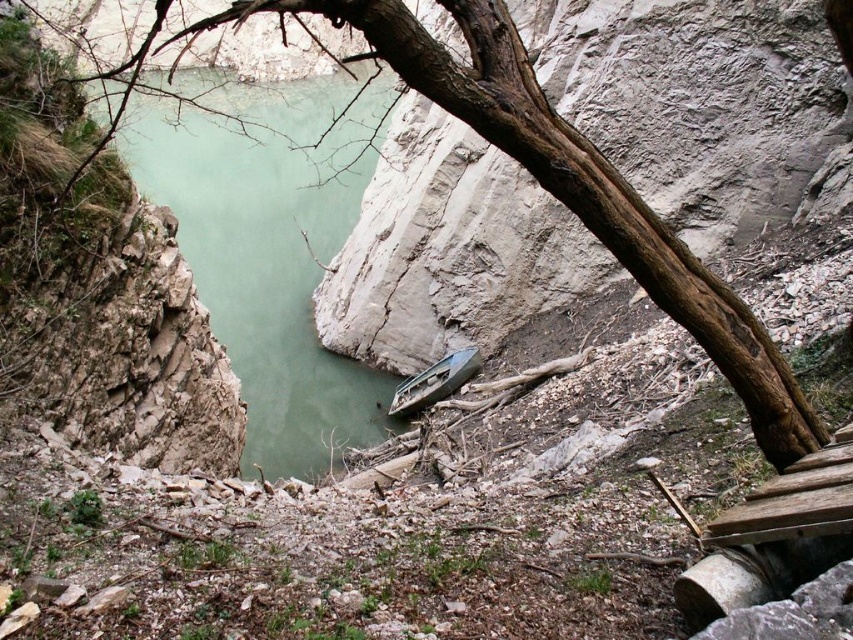
Question: Can you confirm if green smooth water at center is positioned below brown rough tree trunk at upper center?

Choices:
 (A) no
 (B) yes

Answer: (A)

Question: Which object is positioned farthest from the green smooth water at center?

Choices:
 (A) green plastic boat at center
 (B) brown rough tree trunk at upper center

Answer: (A)

Question: Does green smooth water at center have a greater width compared to green plastic boat at center?

Choices:
 (A) no
 (B) yes

Answer: (B)

Question: Is green smooth water at center bigger than green plastic boat at center?

Choices:
 (A) yes
 (B) no

Answer: (A)

Question: Considering the real-world distances, which object is farthest from the green smooth water at center?

Choices:
 (A) green plastic boat at center
 (B) brown rough tree trunk at upper center

Answer: (A)

Question: Which point is farther to the camera?

Choices:
 (A) green smooth water at center
 (B) brown rough tree trunk at upper center

Answer: (A)